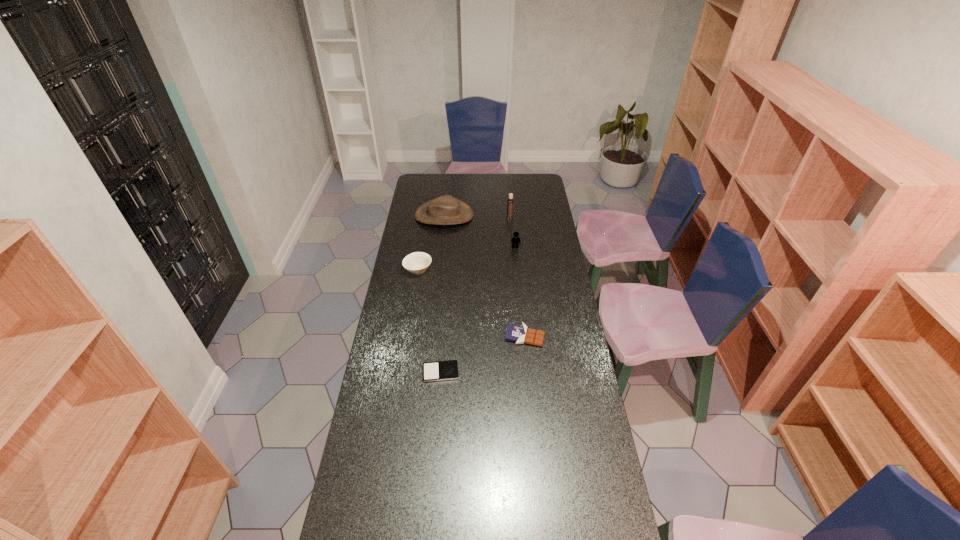
Locate an element on the screen. blank area located on the front of the cowboy hat is located at coordinates (439, 262).

Locate an element on the screen. The image size is (960, 540). vacant space located 0.150m on the front-facing side of the third farthest object is located at coordinates (517, 269).

This screenshot has height=540, width=960. In order to click on free point located 0.190m on the back of the fourth tallest object in this screenshot , I will do `click(423, 237)`.

Where is `free space located on the left of the fifth tallest object`? The height and width of the screenshot is (540, 960). free space located on the left of the fifth tallest object is located at coordinates (490, 336).

In order to click on blank space located 0.300m on the front of the nearest object in this screenshot , I will do `click(434, 462)`.

This screenshot has width=960, height=540. In order to click on cowboy hat that is at the left edge in this screenshot , I will do `click(444, 210)`.

This screenshot has height=540, width=960. Find the location of `bowl that is at the left edge`. bowl that is at the left edge is located at coordinates (417, 262).

Where is `object positioned at the right edge`? This screenshot has width=960, height=540. object positioned at the right edge is located at coordinates (520, 334).

Where is `vacant space at the far edge`? vacant space at the far edge is located at coordinates (486, 178).

Where is `free space at the left edge of the desktop`? free space at the left edge of the desktop is located at coordinates (400, 258).